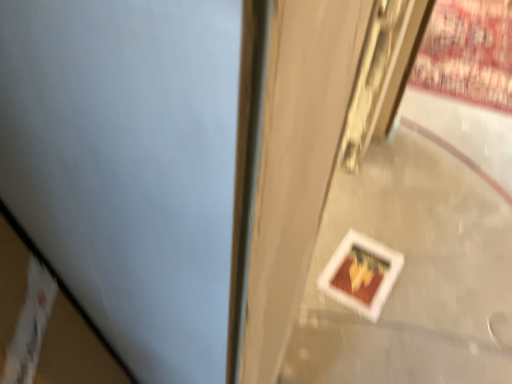
I want to click on matte white postcard at lower right, so click(x=361, y=274).

The image size is (512, 384). What do you see at coordinates (361, 274) in the screenshot?
I see `matte white postcard at lower right` at bounding box center [361, 274].

I want to click on matte white postcard at lower right, so click(x=361, y=274).